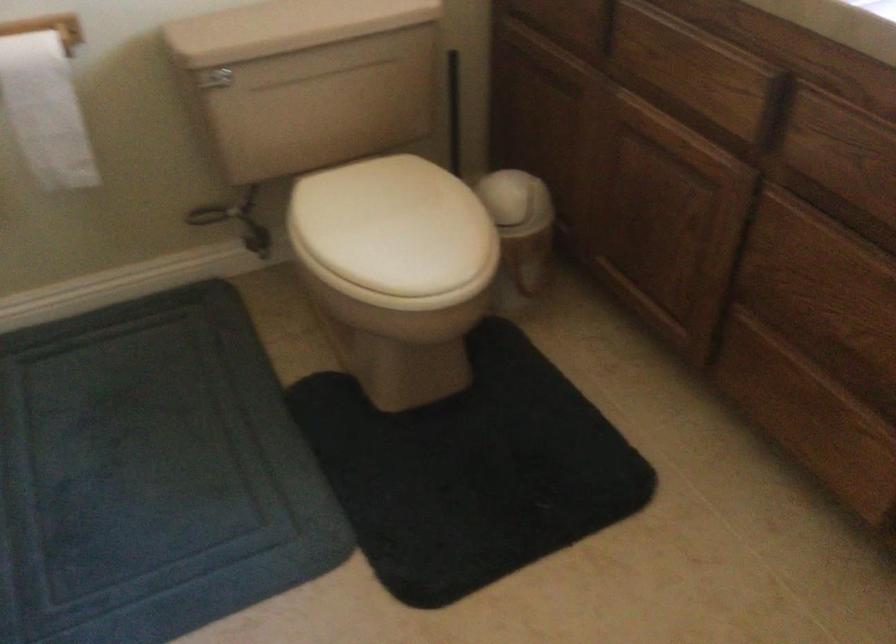
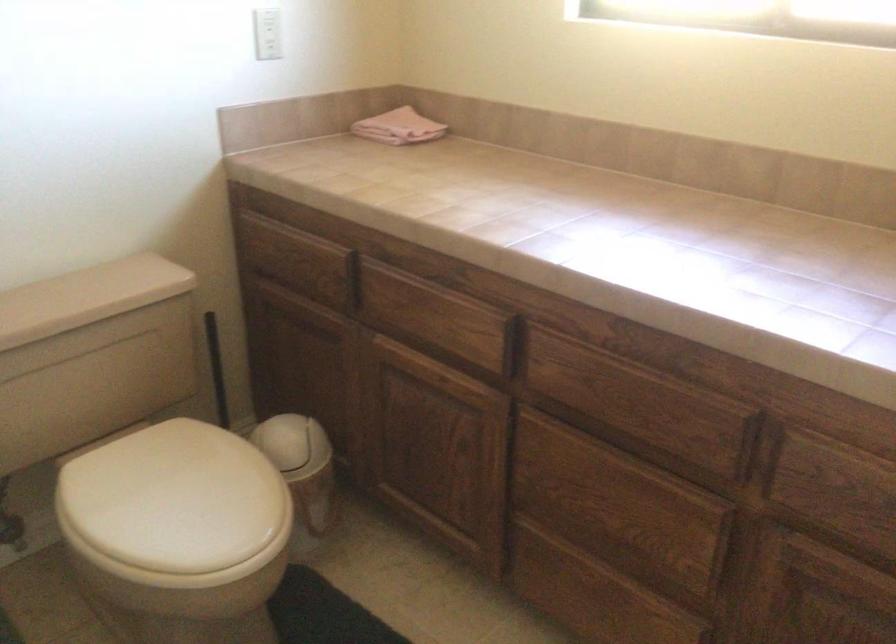
The point at (452, 116) is marked in the first image. Where is the corresponding point in the second image?

(216, 368)